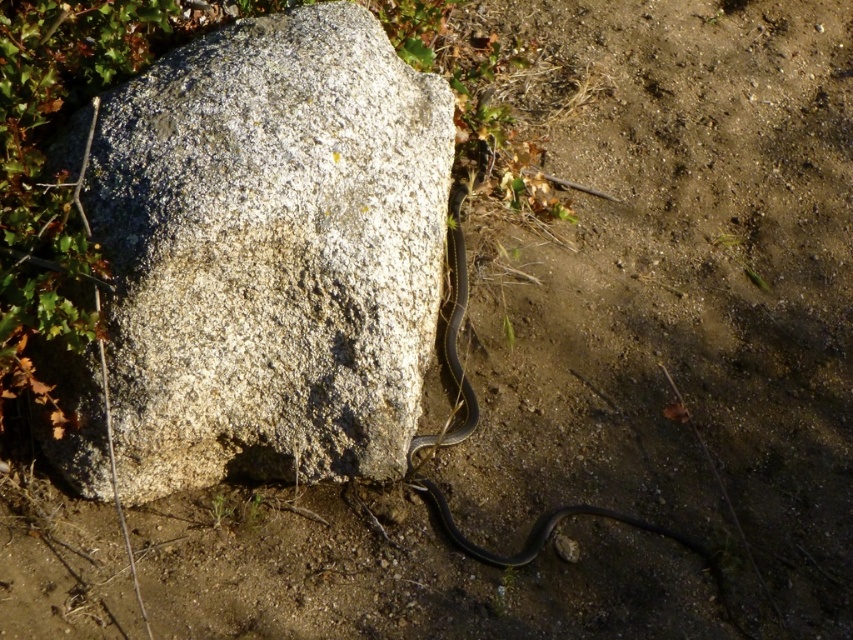
You are a hiker who wants to place a small backpack on the granite rock at center without disturbing the black glossy snake at center. Can you fit the backpack on the rock?

The granite rock at center is bigger than the black glossy snake at center, so yes, the backpack can be placed on the granite rock at center as it is larger in size.

You are standing in the outdoor scene and see a point marked at coordinates (271, 252). Based on the scene description, which object is this point located on?

The point at coordinates (271, 252) is located on the granite rock at center.

You are standing in front of the granite rock at center and the black glossy snake at center. Which object is nearer to you?

The granite rock at center is closer to the viewer than the black glossy snake at center.